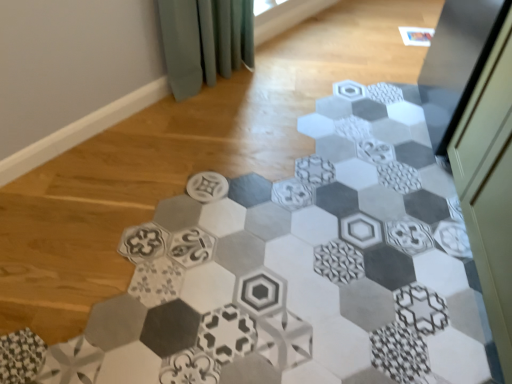
In order to face white glossy picture frame at upper right, should I rotate leftwards or rightwards?

Rotate right and turn 21.568 degrees.

Locate an element on the screen. Image resolution: width=512 pixels, height=384 pixels. white glossy picture frame at upper right is located at coordinates (416, 36).

The image size is (512, 384). Describe the element at coordinates (416, 36) in the screenshot. I see `white glossy picture frame at upper right` at that location.

The image size is (512, 384). In order to click on white glossy picture frame at upper right in this screenshot , I will do `click(416, 36)`.